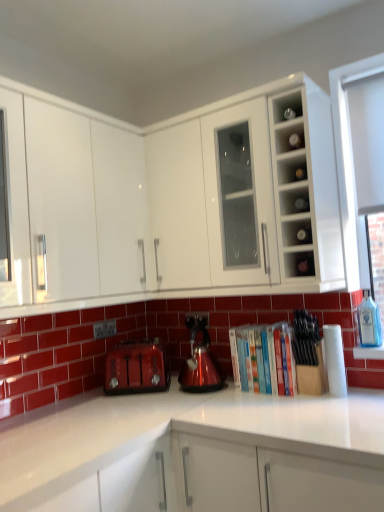
Question: Does shiny metallic kettle at center have a larger size compared to white glossy cabinet at upper center, the second cabinetry viewed from the left?

Choices:
 (A) yes
 (B) no

Answer: (B)

Question: Considering the relative sizes of shiny metallic kettle at center and white glossy cabinet at upper center, the 1th cabinetry in the right-to-left sequence, in the image provided, is shiny metallic kettle at center shorter than white glossy cabinet at upper center, the 1th cabinetry in the right-to-left sequence,?

Choices:
 (A) no
 (B) yes

Answer: (B)

Question: Is shiny metallic kettle at center turned away from white glossy cabinet at upper center, the second cabinetry viewed from the left?

Choices:
 (A) yes
 (B) no

Answer: (B)

Question: Is shiny metallic kettle at center directly adjacent to white glossy cabinet at upper center, the 1th cabinetry in the right-to-left sequence?

Choices:
 (A) no
 (B) yes

Answer: (A)

Question: Is shiny metallic kettle at center closer to the viewer compared to white glossy cabinet at upper center, the second cabinetry viewed from the left?

Choices:
 (A) yes
 (B) no

Answer: (B)

Question: Would you say clear glass bottles at upper right, arranged as the third shelf when viewed from the top, is inside or outside clear glass window at upper right?

Choices:
 (A) inside
 (B) outside

Answer: (B)

Question: Considering their positions, is clear glass bottles at upper right, arranged as the third shelf when viewed from the top, located in front of or behind clear glass window at upper right?

Choices:
 (A) front
 (B) behind

Answer: (A)

Question: In terms of height, does clear glass bottles at upper right, arranged as the third shelf when viewed from the top, look taller or shorter compared to clear glass window at upper right?

Choices:
 (A) tall
 (B) short

Answer: (B)

Question: From a real-world perspective, is clear glass bottles at upper right, the second shelf in the bottom-to-top sequence, physically located above or below clear glass window at upper right?

Choices:
 (A) above
 (B) below

Answer: (B)

Question: From the image's perspective, relative to matte glass bottles at upper right, positioned as the first shelf in top-to-bottom order, is matte glass shelf at upper right, which is counted as the 4th shelf, starting from the top, above or below?

Choices:
 (A) below
 (B) above

Answer: (A)

Question: Is matte glass shelf at upper right, which is the 1th shelf from bottom to top, situated inside matte glass bottles at upper right, positioned as the first shelf in top-to-bottom order, or outside?

Choices:
 (A) outside
 (B) inside

Answer: (A)

Question: From a real-world perspective, is matte glass shelf at upper right, which is the 1th shelf from bottom to top, positioned above or below matte glass bottles at upper right, the 4th shelf in the bottom-to-top sequence?

Choices:
 (A) below
 (B) above

Answer: (A)

Question: Is matte glass shelf at upper right, which is the 1th shelf from bottom to top, in front of or behind matte glass bottles at upper right, positioned as the first shelf in top-to-bottom order, in the image?

Choices:
 (A) front
 (B) behind

Answer: (A)

Question: Is white glossy cabinet at upper left, the 1th cabinetry from the left, situated inside matte red toaster at lower left or outside?

Choices:
 (A) inside
 (B) outside

Answer: (B)

Question: Is white glossy cabinet at upper left, the 1th cabinetry from the left, taller or shorter than matte red toaster at lower left?

Choices:
 (A) tall
 (B) short

Answer: (A)